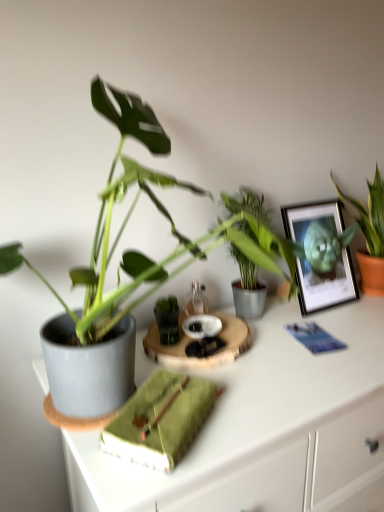
What do you see at coordinates (370, 234) in the screenshot?
I see `green leafy plant at upper right, the 1th houseplant viewed from the back` at bounding box center [370, 234].

What is the approximate width of metallic silver picture frame at upper right?

7.04 inches.

The height and width of the screenshot is (512, 384). In order to click on matte gray pot at center-left, which appears as the 2th houseplant when viewed from the back in this screenshot , I will do `click(128, 219)`.

Describe the element at coordinates (128, 219) in the screenshot. I see `matte gray pot at center-left, which appears as the 2th houseplant when viewed from the back` at that location.

Image resolution: width=384 pixels, height=512 pixels. What do you see at coordinates (266, 426) in the screenshot?
I see `matte gray pot at left` at bounding box center [266, 426].

You are a GUI agent. You are given a task and a screenshot of the screen. Output one action in this format:
    pyautogui.click(x=<x>, y=<y>)
    Task: Click on the green fabric book at center
    The image size is (384, 512).
    Given the screenshot: What is the action you would take?
    pyautogui.click(x=160, y=420)

Is green leafy plant at upper right, acting as the first houseplant starting from the right, turned away from matte gray pot at center-left, which appears as the 1th houseplant when viewed from the left?

green leafy plant at upper right, acting as the first houseplant starting from the right, does not have its back to matte gray pot at center-left, which appears as the 1th houseplant when viewed from the left.

Are green leafy plant at upper right, the 2th houseplant in the front-to-back sequence, and matte gray pot at center-left, which appears as the 1th houseplant when viewed from the left, located far from each other?

No, green leafy plant at upper right, the 2th houseplant in the front-to-back sequence, is not far from matte gray pot at center-left, which appears as the 1th houseplant when viewed from the left.

From a real-world perspective, which object rests below the other?

green leafy plant at upper right, the 1th houseplant viewed from the back.

Between green leafy plant at upper right, marked as the second houseplant in a left-to-right arrangement, and matte gray pot at center-left, which appears as the 2th houseplant when viewed from the right, which one is positioned in front?

matte gray pot at center-left, which appears as the 2th houseplant when viewed from the right, is closer to the camera.

Based on the photo, between matte gray pot at center-left, which appears as the 2th houseplant when viewed from the back, and matte gray pot at left, which one has more height?

matte gray pot at left is taller.

Consider the image. Which of these two, matte gray pot at center-left, which appears as the 2th houseplant when viewed from the right, or matte gray pot at left, is thinner?

matte gray pot at center-left, which appears as the 2th houseplant when viewed from the right, is thinner.

Consider the image. How different are the orientations of matte gray pot at center-left, the first houseplant from the front, and matte gray pot at left in degrees?

The angle between the facing direction of matte gray pot at center-left, the first houseplant from the front, and the facing direction of matte gray pot at left is 0.91 degrees.

Based on the photo, from a real-world perspective, is matte gray pot at center-left, the first houseplant from the front, above or below matte gray pot at left?

matte gray pot at center-left, the first houseplant from the front, is situated higher than matte gray pot at left in the real world.

In the image, is green leafy plant at upper right, the 2th houseplant in the front-to-back sequence, positioned in front of or behind metallic silver picture frame at upper right?

In the image, green leafy plant at upper right, the 2th houseplant in the front-to-back sequence, appears behind metallic silver picture frame at upper right.

In order to click on houseplant behind the metallic silver picture frame at upper right in this screenshot , I will do `click(370, 234)`.

Visually, is green leafy plant at upper right, acting as the first houseplant starting from the right, positioned to the left or to the right of metallic silver picture frame at upper right?

Based on their positions, green leafy plant at upper right, acting as the first houseplant starting from the right, is located to the right of metallic silver picture frame at upper right.

Is matte gray pot at left turned away from metallic silver picture frame at upper right?

matte gray pot at left is not turned away from metallic silver picture frame at upper right.

At what (x,y) coordinates should I click in order to perform the action: click on desk that appears below the metallic silver picture frame at upper right (from the image's perspective). Please return your answer as a coordinate pair (x, y). This screenshot has height=512, width=384. Looking at the image, I should click on (266, 426).

Can you see matte gray pot at left touching metallic silver picture frame at upper right?

No, matte gray pot at left is not touching metallic silver picture frame at upper right.

How many degrees apart are the facing directions of metallic silver picture frame at upper right and matte gray pot at center-left, which appears as the 2th houseplant when viewed from the back?

The facing directions of metallic silver picture frame at upper right and matte gray pot at center-left, which appears as the 2th houseplant when viewed from the back, are 0.000405 degrees apart.

Is point (329, 229) positioned in front of point (158, 182)?

No, (329, 229) is behind (158, 182).

Is metallic silver picture frame at upper right wider or thinner than matte gray pot at center-left, which appears as the 1th houseplant when viewed from the left?

Clearly, metallic silver picture frame at upper right has less width compared to matte gray pot at center-left, which appears as the 1th houseplant when viewed from the left.

From a real-world perspective, is metallic silver picture frame at upper right above or below matte gray pot at center-left, which appears as the 2th houseplant when viewed from the back?

metallic silver picture frame at upper right is situated lower than matte gray pot at center-left, which appears as the 2th houseplant when viewed from the back, in the real world.

What's the angular difference between green leafy plant at upper right, marked as the second houseplant in a left-to-right arrangement, and matte gray pot at left's facing directions?

0.909 degrees separate the facing orientations of green leafy plant at upper right, marked as the second houseplant in a left-to-right arrangement, and matte gray pot at left.

From the image's perspective, is green leafy plant at upper right, acting as the first houseplant starting from the right, on matte gray pot at left?

Indeed, from the image's perspective, green leafy plant at upper right, acting as the first houseplant starting from the right, is shown above matte gray pot at left.

Which is closer, (336, 187) or (354, 317)?

The point (354, 317) is in front.

Is point (171, 492) positioned before point (377, 230)?

Yes, it is.

Is matte gray pot at left at the right side of green leafy plant at upper right, the 2th houseplant in the front-to-back sequence?

No.

Looking at their sizes, would you say matte gray pot at left is wider or thinner than green leafy plant at upper right, acting as the first houseplant starting from the right?

Clearly, matte gray pot at left has more width compared to green leafy plant at upper right, acting as the first houseplant starting from the right.

Can you tell me how much matte gray pot at left and green leafy plant at upper right, the 2th houseplant in the front-to-back sequence, differ in facing direction?

0.909 degrees separate the facing orientations of matte gray pot at left and green leafy plant at upper right, the 2th houseplant in the front-to-back sequence.

This screenshot has height=512, width=384. Find the location of `houseplant on the right side of matte gray pot at center-left, the first houseplant from the front`. houseplant on the right side of matte gray pot at center-left, the first houseplant from the front is located at coordinates (370, 234).

From a real-world perspective, starting from the matte gray pot at left, which houseplant is the 2nd one vertically above it? Please provide its 2D coordinates.

[(128, 219)]

From the image, which object appears to be farther from green leafy plant at upper right, the 1th houseplant viewed from the back, metallic silver picture frame at upper right or matte gray pot at center-left, which appears as the 1th houseplant when viewed from the left?

matte gray pot at center-left, which appears as the 1th houseplant when viewed from the left.

Looking at the image, which one is located further to matte gray pot at left, green fabric book at center or metallic silver picture frame at upper right?

metallic silver picture frame at upper right is positioned further to the anchor matte gray pot at left.

Which object lies further to the anchor point green leafy plant at upper right, marked as the second houseplant in a left-to-right arrangement, green fabric book at center or matte gray pot at left?

The object further to green leafy plant at upper right, marked as the second houseplant in a left-to-right arrangement, is green fabric book at center.

Based on the photo, based on their spatial positions, is green fabric book at center or matte gray pot at left further from matte gray pot at center-left, which appears as the 1th houseplant when viewed from the left?

The object further to matte gray pot at center-left, which appears as the 1th houseplant when viewed from the left, is matte gray pot at left.

From the picture: From the image, which object appears to be nearer to matte gray pot at center-left, which appears as the 1th houseplant when viewed from the left, matte gray pot at left or green fabric book at center?

The object closer to matte gray pot at center-left, which appears as the 1th houseplant when viewed from the left, is green fabric book at center.

Which object lies further to the anchor point matte gray pot at center-left, the first houseplant from the front, green fabric book at center or green leafy plant at upper right, the 1th houseplant viewed from the back?

green leafy plant at upper right, the 1th houseplant viewed from the back, lies further to matte gray pot at center-left, the first houseplant from the front, than the other object.

When comparing their distances from green leafy plant at upper right, the 2th houseplant in the front-to-back sequence, does green fabric book at center or matte gray pot at center-left, which appears as the 2th houseplant when viewed from the right, seem further?

Based on the image, green fabric book at center appears to be further to green leafy plant at upper right, the 2th houseplant in the front-to-back sequence.

Based on the photo, estimate the real-world distances between objects in this image. Which object is closer to matte gray pot at left, matte gray pot at center-left, which appears as the 2th houseplant when viewed from the back, or green fabric book at center?

Among the two, green fabric book at center is located nearer to matte gray pot at left.

You are a GUI agent. You are given a task and a screenshot of the screen. Output one action in this format:
    pyautogui.click(x=<x>, y=<y>)
    Task: Click on the desk between matte gray pot at center-left, which appears as the 2th houseplant when viewed from the back, and metallic silver picture frame at upper right in the front-back direction
    
    Given the screenshot: What is the action you would take?
    pyautogui.click(x=266, y=426)

You are a GUI agent. You are given a task and a screenshot of the screen. Output one action in this format:
    pyautogui.click(x=<x>, y=<y>)
    Task: Click on the book that lies between green leafy plant at upper right, marked as the second houseplant in a left-to-right arrangement, and matte gray pot at left from top to bottom
    The width and height of the screenshot is (384, 512).
    Given the screenshot: What is the action you would take?
    pyautogui.click(x=160, y=420)

At what (x,y) coordinates should I click in order to perform the action: click on desk positioned between matte gray pot at center-left, which appears as the 2th houseplant when viewed from the back, and green leafy plant at upper right, marked as the second houseplant in a left-to-right arrangement, from near to far. Please return your answer as a coordinate pair (x, y). Looking at the image, I should click on (266, 426).

Identify the location of book between matte gray pot at center-left, which appears as the 2th houseplant when viewed from the right, and green leafy plant at upper right, the 2th houseplant in the front-to-back sequence, in the front-back direction. The width and height of the screenshot is (384, 512). (160, 420).